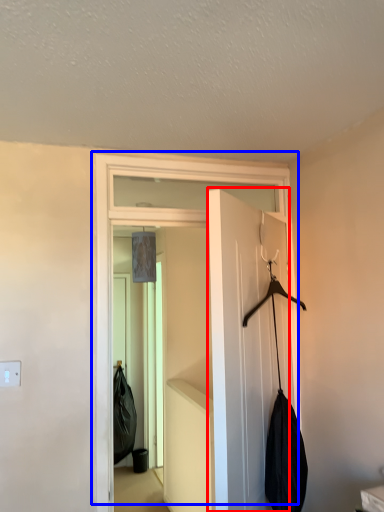
Question: Which object is further to the camera taking this photo, door (highlighted by a red box) or door (highlighted by a blue box)?

Choices:
 (A) door
 (B) door

Answer: (B)